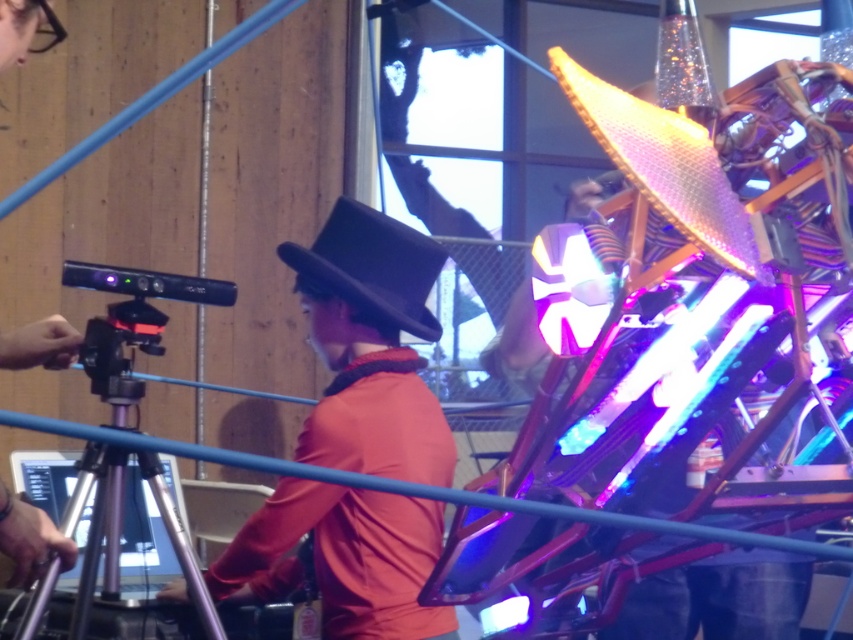
The image size is (853, 640). Describe the element at coordinates (96, 524) in the screenshot. I see `silver metallic tripod at lower left` at that location.

Is point (112, 540) more distant than point (15, 573)?

That is True.

I want to click on silver metallic tripod at lower left, so pyautogui.click(x=96, y=524).

Who is higher up, silver metallic tripod at lower left or black felt hat at center?

Positioned higher is black felt hat at center.

Can you confirm if silver metallic tripod at lower left is taller than black felt hat at center?

Yes.

Between point (126, 452) and point (352, 205), which one is positioned in front?

Point (352, 205) is in front.

The width and height of the screenshot is (853, 640). Find the location of `silver metallic tripod at lower left`. silver metallic tripod at lower left is located at coordinates (96, 524).

Between matte black hat at center and black felt hat at center, which one appears on the left side from the viewer's perspective?

Positioned to the left is matte black hat at center.

Is matte black hat at center taller than black felt hat at center?

Correct, matte black hat at center is much taller as black felt hat at center.

Measure the distance between matte black hat at center and camera.

2.43 meters

Locate an element on the screen. This screenshot has width=853, height=640. matte black hat at center is located at coordinates (370, 346).